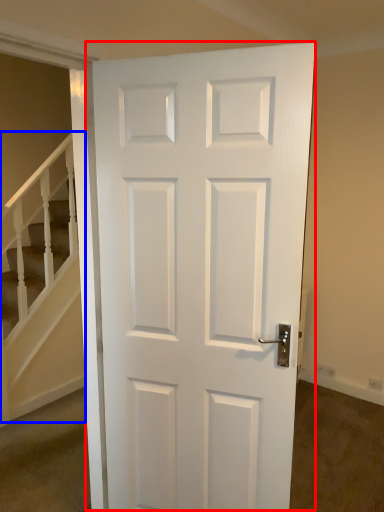
Question: Which object is further to the camera taking this photo, door (highlighted by a red box) or stairwell (highlighted by a blue box)?

Choices:
 (A) door
 (B) stairwell

Answer: (B)